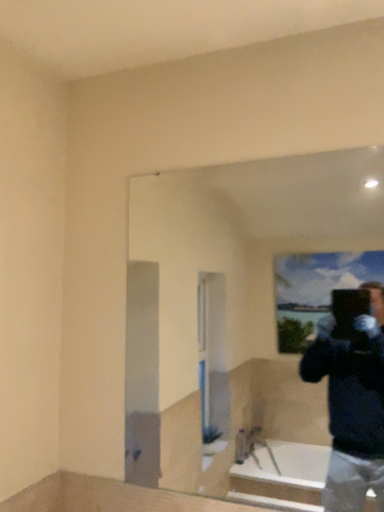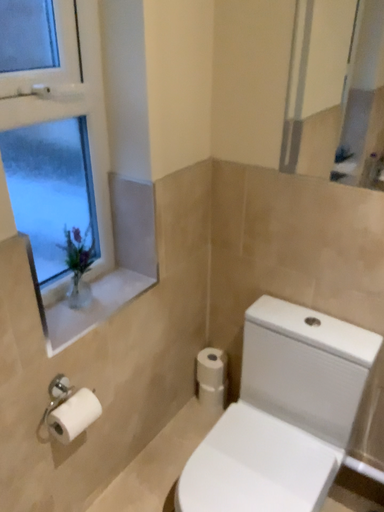
Question: Which way did the camera rotate in the video?

Choices:
 (A) rotated right
 (B) rotated left

Answer: (B)